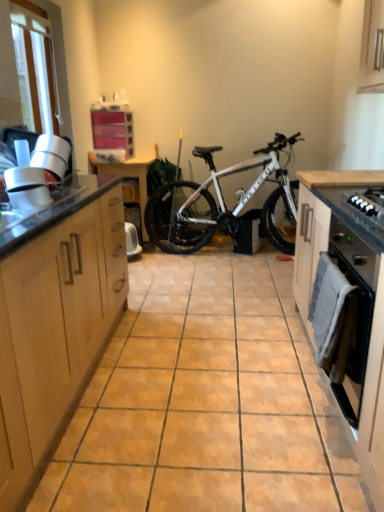
Question: From a real-world perspective, is orange matte tile at center positioned above or below black matte oven door at right, which ranks as the second cabinetry in left-to-right order?

Choices:
 (A) above
 (B) below

Answer: (B)

Question: Considering their positions, is orange matte tile at center located in front of or behind black matte oven door at right, marked as the 1th cabinetry in a right-to-left arrangement?

Choices:
 (A) front
 (B) behind

Answer: (B)

Question: Based on their relative distances, which object is farther from the white matte bicycle at center?

Choices:
 (A) black matte gas stove at right
 (B) orange matte tile at center
 (C) white glossy vent at left
 (D) wooden at right
 (E) transparent glass window at upper left

Answer: (C)

Question: Based on their relative distances, which object is farther from the orange matte tile at center?

Choices:
 (A) black matte oven door at right, which ranks as the second cabinetry in left-to-right order
 (B) light wood cabinet at left, positioned as the second cabinetry in right-to-left order
 (C) white matte bicycle at center
 (D) black matte oven at right
 (E) white glossy vent at left

Answer: (C)